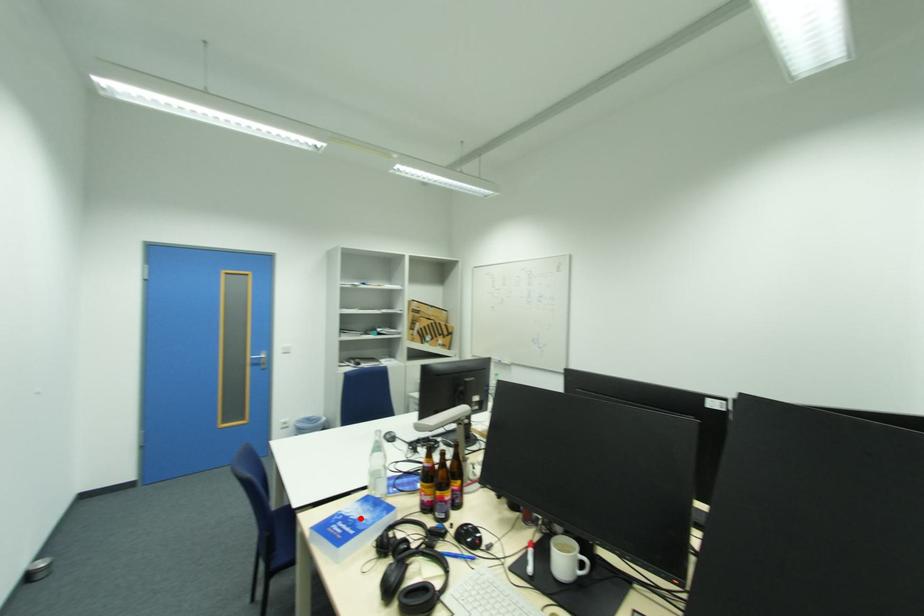
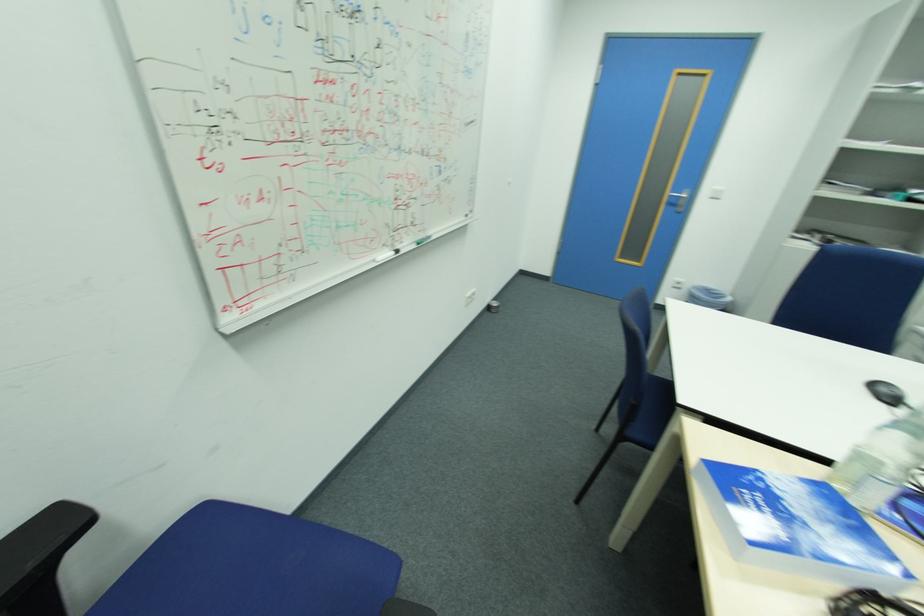
Where in the second image is the point corresponding to the highlighted location from the first image?

(796, 512)